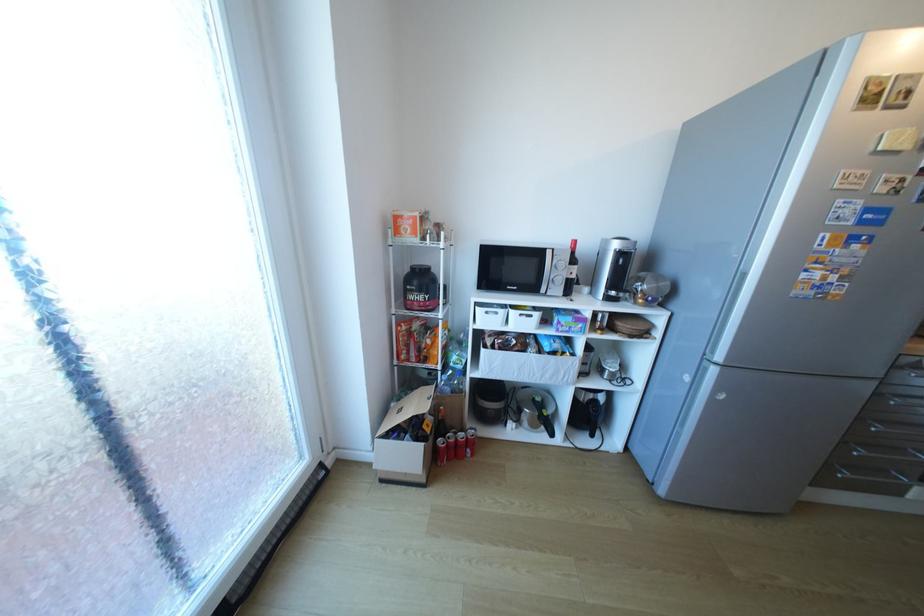
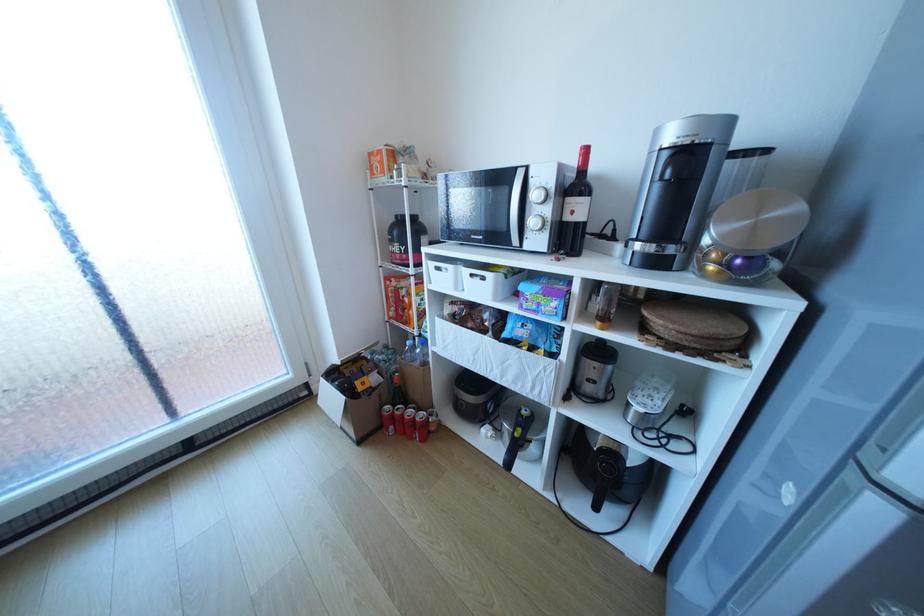
Question: The camera is either moving clockwise (left) or counter-clockwise (right) around the object. The first image is from the beginning of the video and the second image is from the end. Is the camera moving left or right when shooting the video?

Choices:
 (A) Left
 (B) Right

Answer: (B)